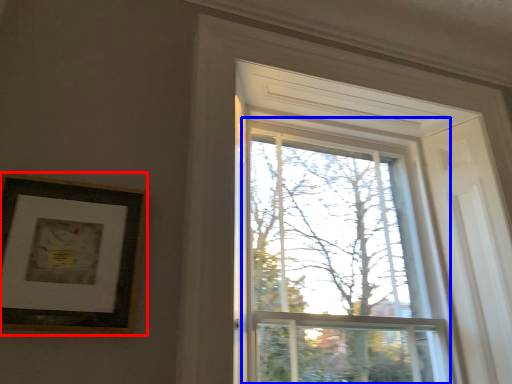
Question: Among these objects, which one is farthest to the camera, picture frame (highlighted by a red box) or glass window (highlighted by a blue box)?

Choices:
 (A) picture frame
 (B) glass window

Answer: (B)